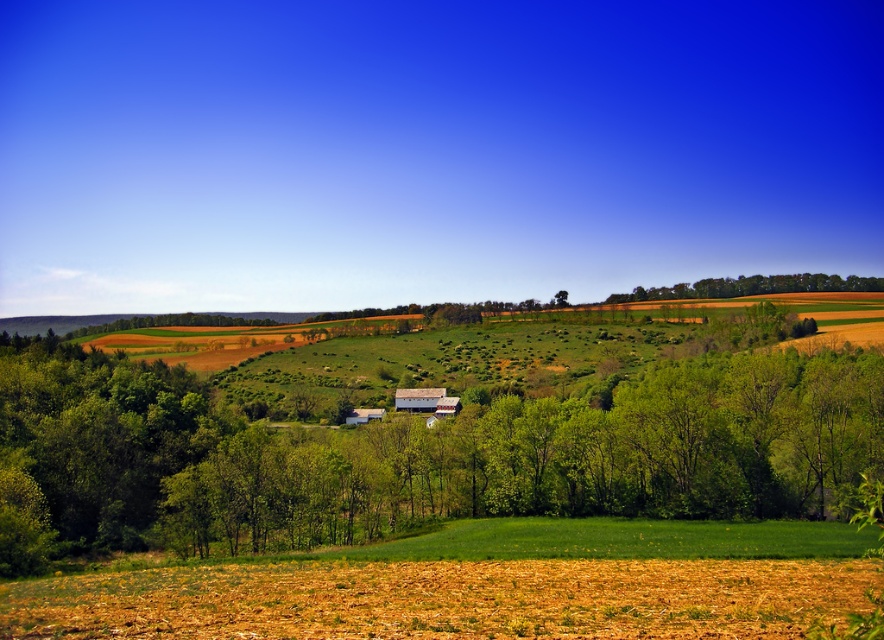
Question: Can you confirm if green leafy tree at center is thinner than green leafy trees at upper center?

Choices:
 (A) yes
 (B) no

Answer: (B)

Question: Which point is farther to the camera?

Choices:
 (A) (753, 285)
 (B) (836, 362)

Answer: (A)

Question: Does green leafy tree at center have a smaller size compared to green leafy trees at upper center?

Choices:
 (A) yes
 (B) no

Answer: (B)

Question: Does green leafy tree at center have a lesser width compared to green leafy trees at upper center?

Choices:
 (A) no
 (B) yes

Answer: (A)

Question: Among these objects, which one is nearest to the camera?

Choices:
 (A) green leafy trees at upper center
 (B) green leafy tree at center

Answer: (B)